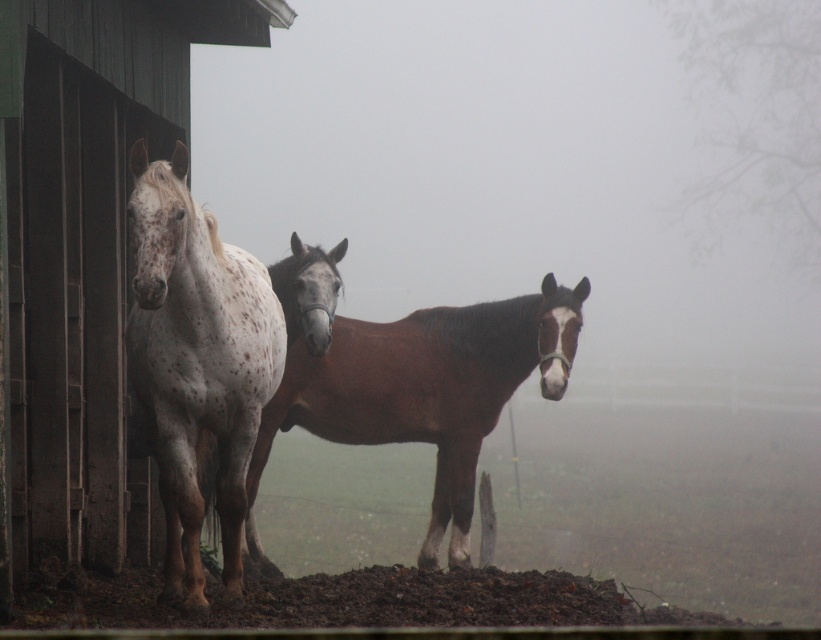
Does brown glossy horse at center have a larger size compared to speckled white horse at center?

Yes.

Does brown glossy horse at center appear under speckled white horse at center?

Incorrect, brown glossy horse at center is not positioned below speckled white horse at center.

Describe the element at coordinates (424, 392) in the screenshot. I see `brown glossy horse at center` at that location.

Identify the location of brown glossy horse at center. The width and height of the screenshot is (821, 640). (424, 392).

Who is positioned more to the right, speckled white horse at left or speckled white horse at center?

Positioned to the right is speckled white horse at center.

Is speckled white horse at left positioned before speckled white horse at center?

Yes, speckled white horse at left is in front of speckled white horse at center.

Measure the distance between speckled white horse at left and camera.

speckled white horse at left is 20.77 feet away from camera.

Locate an element on the screen. speckled white horse at left is located at coordinates (195, 362).

Is point (672, 246) closer to camera compared to point (301, 252)?

No, it is behind (301, 252).

Is foggy atmosphere at center smaller than speckled white horse at center?

No.

Find the location of `foggy atmosphere at center`. foggy atmosphere at center is located at coordinates (511, 186).